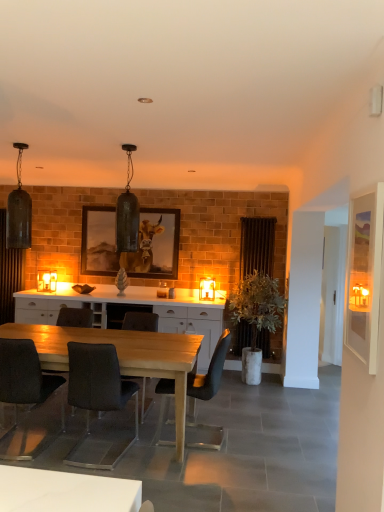
Question: From the image's perspective, does dark gray fabric chair at center, the 3th chair viewed from the right, appear higher than wooden framed picture of cow at center?

Choices:
 (A) yes
 (B) no

Answer: (B)

Question: Considering the relative sizes of dark gray fabric chair at center, marked as the second chair in a left-to-right arrangement, and wooden framed picture of cow at center in the image provided, is dark gray fabric chair at center, marked as the second chair in a left-to-right arrangement, wider than wooden framed picture of cow at center?

Choices:
 (A) yes
 (B) no

Answer: (A)

Question: Is dark gray fabric chair at center, marked as the second chair in a left-to-right arrangement, oriented away from wooden framed picture of cow at center?

Choices:
 (A) no
 (B) yes

Answer: (A)

Question: Is there a large distance between dark gray fabric chair at center, the 3th chair viewed from the right, and wooden framed picture of cow at center?

Choices:
 (A) yes
 (B) no

Answer: (A)

Question: Does dark gray fabric chair at center, marked as the second chair in a left-to-right arrangement, have a smaller size compared to wooden framed picture of cow at center?

Choices:
 (A) yes
 (B) no

Answer: (B)

Question: In the image, is matte black pendant light at upper left, marked as the third lamp in a right-to-left arrangement, on the left side or the right side of dark gray fabric chair at center, marked as the 3th chair in a left-to-right arrangement?

Choices:
 (A) right
 (B) left

Answer: (B)

Question: From a real-world perspective, relative to dark gray fabric chair at center, marked as the 3th chair in a left-to-right arrangement, is matte black pendant light at upper left, marked as the third lamp in a right-to-left arrangement, vertically above or below?

Choices:
 (A) above
 (B) below

Answer: (A)

Question: Is matte black pendant light at upper left, the 2th lamp viewed from the front, in front of or behind dark gray fabric chair at center, marked as the second chair in a right-to-left arrangement, in the image?

Choices:
 (A) front
 (B) behind

Answer: (A)

Question: Which is correct: matte black pendant light at upper left, marked as the third lamp in a right-to-left arrangement, is inside dark gray fabric chair at center, marked as the second chair in a right-to-left arrangement, or outside of it?

Choices:
 (A) outside
 (B) inside

Answer: (A)

Question: From a real-world perspective, is dark gray fabric chair at lower left, which ranks as the first chair in left-to-right order, physically located above or below matte black chair at center, positioned as the 4th chair in left-to-right order?

Choices:
 (A) above
 (B) below

Answer: (B)

Question: Relative to matte black chair at center, positioned as the 4th chair in left-to-right order, is dark gray fabric chair at lower left, which ranks as the first chair in left-to-right order, in front or behind?

Choices:
 (A) behind
 (B) front

Answer: (B)

Question: Is dark gray fabric chair at lower left, which appears as the 4th chair when viewed from the right, inside the boundaries of matte black chair at center, positioned as the 4th chair in left-to-right order, or outside?

Choices:
 (A) inside
 (B) outside

Answer: (B)

Question: Based on their sizes in the image, would you say dark gray fabric chair at lower left, which appears as the 4th chair when viewed from the right, is bigger or smaller than matte black chair at center, positioned as the 4th chair in left-to-right order?

Choices:
 (A) small
 (B) big

Answer: (A)

Question: Considering the positions of wooden framed picture of cow at center and matte black pendant light at upper left, acting as the third lamp starting from the back, in the image, is wooden framed picture of cow at center taller or shorter than matte black pendant light at upper left, acting as the third lamp starting from the back,?

Choices:
 (A) tall
 (B) short

Answer: (A)

Question: From a real-world perspective, is wooden framed picture of cow at center above or below matte black pendant light at upper left, the second lamp when ordered from left to right?

Choices:
 (A) below
 (B) above

Answer: (A)